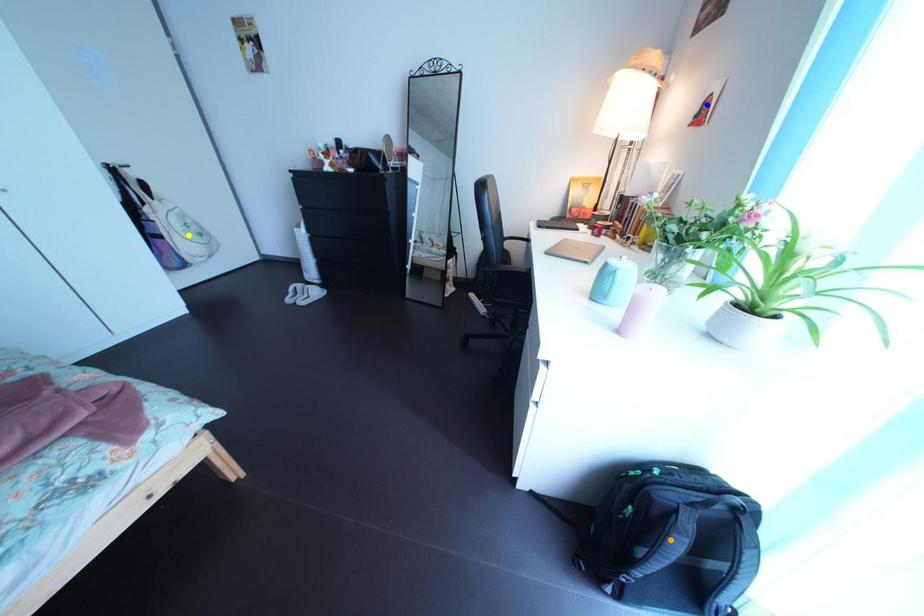
Order these from farthest to nearest:
orange point, yellow point, blue point

1. yellow point
2. blue point
3. orange point